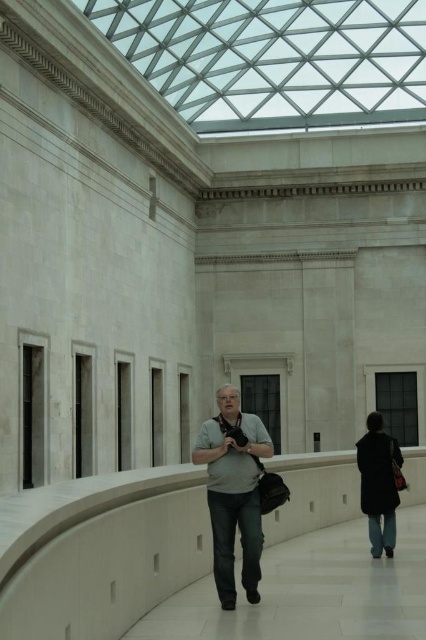
Is gray matte shirt at center to the left of dark blue coat at lower right from the viewer's perspective?

Indeed, gray matte shirt at center is positioned on the left side of dark blue coat at lower right.

The height and width of the screenshot is (640, 426). Identify the location of gray matte shirt at center. point(233,492).